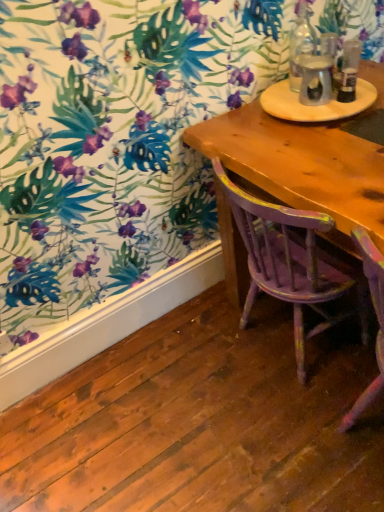
Question: Considering the relative sizes of clear glass bottle at upper right, the 1th bottle viewed from the left, and wooden round table at upper right in the image provided, is clear glass bottle at upper right, the 1th bottle viewed from the left, smaller than wooden round table at upper right?

Choices:
 (A) no
 (B) yes

Answer: (B)

Question: From a real-world perspective, is clear glass bottle at upper right, the 2th bottle from the right, over wooden round table at upper right?

Choices:
 (A) yes
 (B) no

Answer: (A)

Question: Is clear glass bottle at upper right, the 2th bottle from the right, in contact with wooden round table at upper right?

Choices:
 (A) yes
 (B) no

Answer: (B)

Question: Considering the relative sizes of clear glass bottle at upper right, the 1th bottle viewed from the left, and wooden round table at upper right in the image provided, is clear glass bottle at upper right, the 1th bottle viewed from the left, bigger than wooden round table at upper right?

Choices:
 (A) yes
 (B) no

Answer: (B)

Question: From the image's perspective, is clear glass bottle at upper right, the 2th bottle from the right, on wooden round table at upper right?

Choices:
 (A) yes
 (B) no

Answer: (A)

Question: From the image's perspective, relative to distressed purple wood chair at center, is clear glass bottle at upper right, the 1th bottle viewed from the left, above or below?

Choices:
 (A) below
 (B) above

Answer: (B)

Question: Would you say clear glass bottle at upper right, the 1th bottle viewed from the left, is to the left or to the right of distressed purple wood chair at center in the picture?

Choices:
 (A) right
 (B) left

Answer: (A)

Question: From a real-world perspective, is clear glass bottle at upper right, the 1th bottle viewed from the left, positioned above or below distressed purple wood chair at center?

Choices:
 (A) above
 (B) below

Answer: (A)

Question: Choose the correct answer: Is clear glass bottle at upper right, the 1th bottle viewed from the left, inside distressed purple wood chair at center or outside it?

Choices:
 (A) inside
 (B) outside

Answer: (B)

Question: Choose the correct answer: Is clear glass bottle at upper right, the 1th bottle viewed from the left, inside clear glass bottle at upper right, the 2th bottle in the left-to-right sequence, or outside it?

Choices:
 (A) outside
 (B) inside

Answer: (A)

Question: From the image's perspective, is clear glass bottle at upper right, the 1th bottle viewed from the left, above or below clear glass bottle at upper right, which ranks as the 1th bottle in right-to-left order?

Choices:
 (A) above
 (B) below

Answer: (A)

Question: In terms of width, does clear glass bottle at upper right, the 1th bottle viewed from the left, look wider or thinner when compared to clear glass bottle at upper right, which ranks as the 1th bottle in right-to-left order?

Choices:
 (A) wide
 (B) thin

Answer: (B)

Question: Visually, is clear glass bottle at upper right, the 2th bottle from the right, positioned to the left or to the right of clear glass bottle at upper right, the 2th bottle in the left-to-right sequence?

Choices:
 (A) right
 (B) left

Answer: (B)

Question: From a real-world perspective, is clear glass bottle at upper right, the 2th bottle in the left-to-right sequence, physically located above or below distressed purple wood chair at center?

Choices:
 (A) above
 (B) below

Answer: (A)

Question: From the image's perspective, is clear glass bottle at upper right, which ranks as the 1th bottle in right-to-left order, positioned above or below distressed purple wood chair at center?

Choices:
 (A) below
 (B) above

Answer: (B)